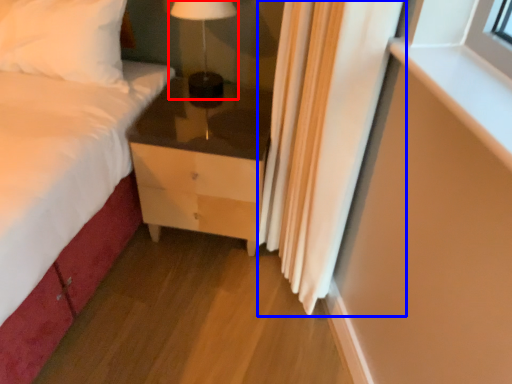
Question: Which point is further to the camera, table lamp (highlighted by a red box) or curtain (highlighted by a blue box)?

Choices:
 (A) table lamp
 (B) curtain

Answer: (A)